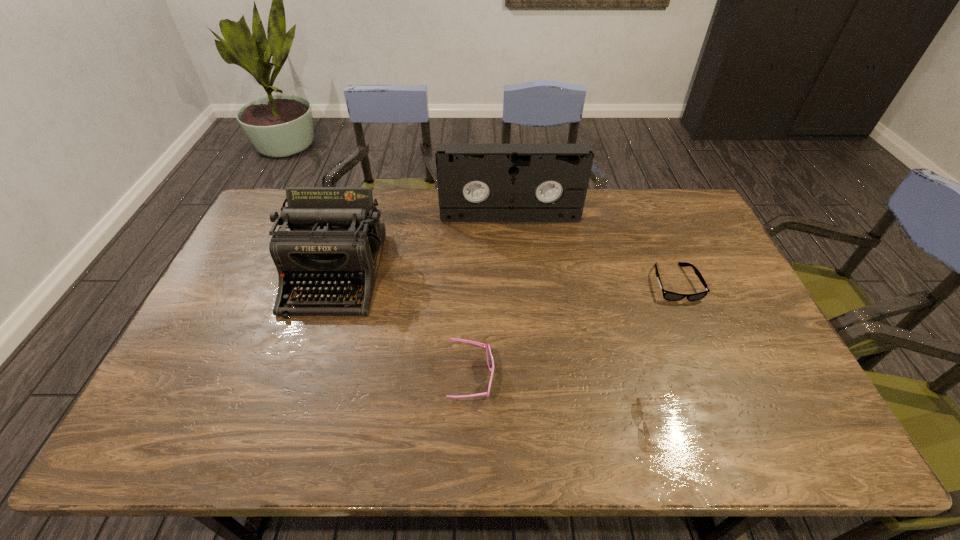
Where is `free location located on the keyboard of the typewriter`? The height and width of the screenshot is (540, 960). free location located on the keyboard of the typewriter is located at coordinates (306, 366).

The image size is (960, 540). I want to click on vacant space situated on the front-facing side of the tallest sunglasses, so click(605, 378).

Locate an element on the screen. free space located on the front-facing side of the rightmost sunglasses is located at coordinates (715, 380).

At what (x,y) coordinates should I click in order to perform the action: click on free point located on the face of the second object from right to left. Please return your answer as a coordinate pair (x, y). Looking at the image, I should click on (473, 424).

Where is `free region located on the face of the second object from right to left`? free region located on the face of the second object from right to left is located at coordinates (478, 424).

Find the location of a particular element. Image resolution: width=960 pixels, height=540 pixels. vacant space positioned on the face of the second object from right to left is located at coordinates pos(499,424).

Locate an element on the screen. This screenshot has height=540, width=960. object that is at the far edge is located at coordinates (476, 182).

Identify the location of object that is at the near edge. (639, 406).

This screenshot has height=540, width=960. What are the coordinates of `object present at the right edge` in the screenshot? It's located at (667, 295).

This screenshot has height=540, width=960. Identify the location of blank space at the far edge of the desktop. (627, 202).